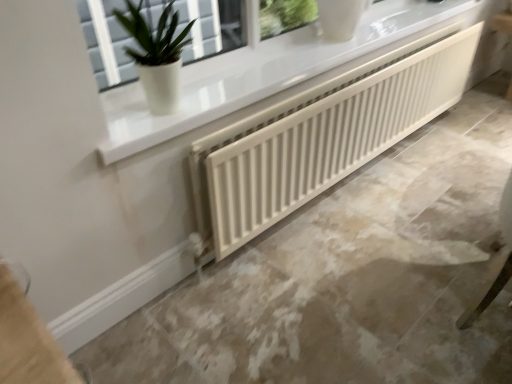
This screenshot has width=512, height=384. I want to click on vacant space underneath white ribbed radiator at center (from a real-world perspective), so click(357, 178).